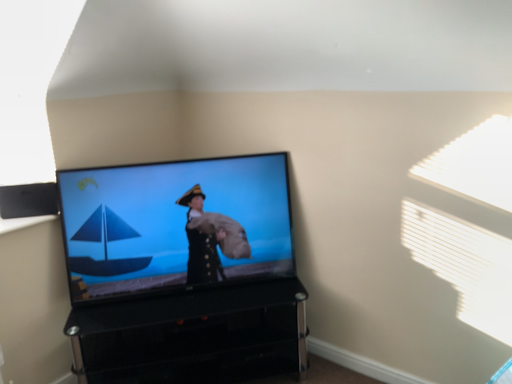
Question: Is point (11, 185) positioned closer to the camera than point (115, 347)?

Choices:
 (A) farther
 (B) closer

Answer: (B)

Question: Looking at the image, does black plastic speaker at upper left seem bigger or smaller compared to black glossy tv stand at lower center?

Choices:
 (A) small
 (B) big

Answer: (A)

Question: Which object is positioned farthest from the black plastic speaker at upper left?

Choices:
 (A) black glossy tv stand at lower center
 (B) matte black tv at center

Answer: (A)

Question: Estimate the real-world distances between objects in this image. Which object is farther from the black glossy tv stand at lower center?

Choices:
 (A) black plastic speaker at upper left
 (B) matte black tv at center

Answer: (A)